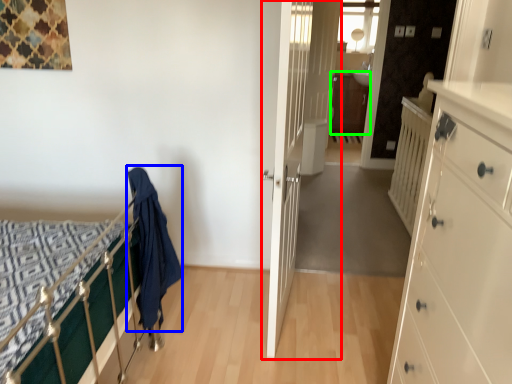
Question: Which is farther away from door (highlighted by a red box)? cloth (highlighted by a blue box) or file cabinet (highlighted by a green box)?

Choices:
 (A) cloth
 (B) file cabinet

Answer: (A)